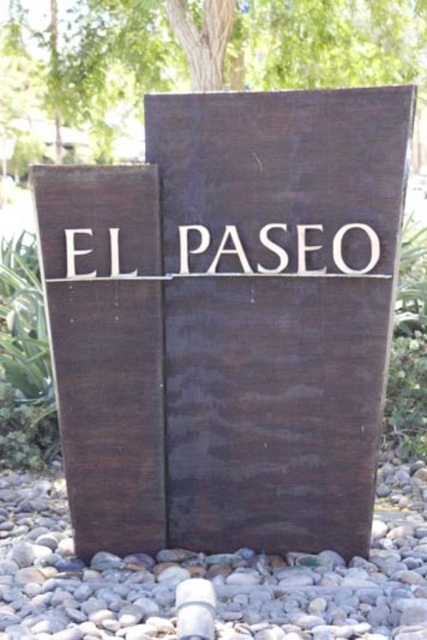
Is dark brown wood sign at center above gray gravel at lower center?

Yes, dark brown wood sign at center is above gray gravel at lower center.

Between dark brown wood sign at center and gray gravel at lower center, which one appears on the left side from the viewer's perspective?

gray gravel at lower center is more to the left.

Is point (266, 410) farther from camera compared to point (263, 579)?

That is True.

Where is `dark brown wood sign at center`? The height and width of the screenshot is (640, 427). dark brown wood sign at center is located at coordinates (228, 321).